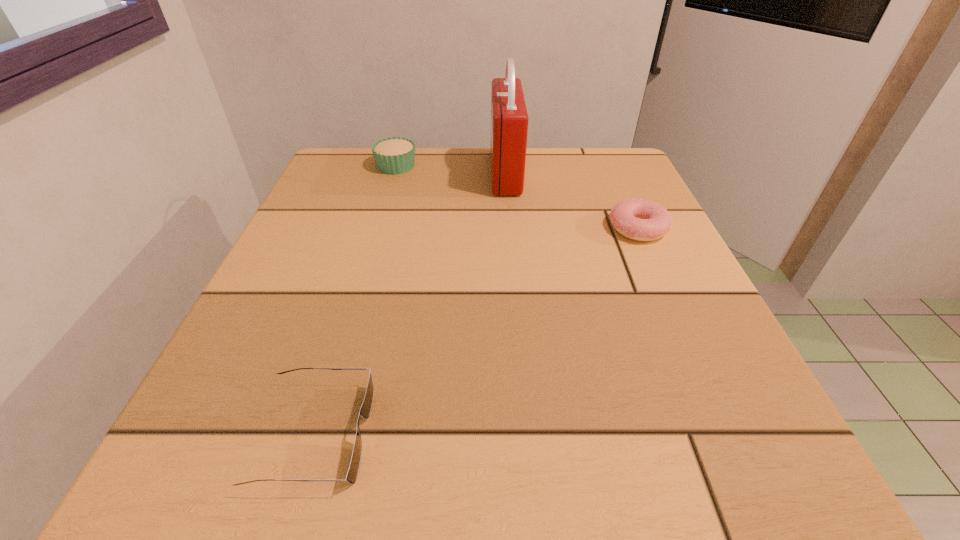
Where is `free region located 0.290m on the front of the rightmost object`? free region located 0.290m on the front of the rightmost object is located at coordinates (707, 379).

Locate an element on the screen. Image resolution: width=960 pixels, height=540 pixels. free location located on the front-facing side of the nearest object is located at coordinates (548, 434).

You are a GUI agent. You are given a task and a screenshot of the screen. Output one action in this format:
    pyautogui.click(x=<x>, y=<y>)
    Task: Click on the first-aid kit at the far edge
    The width and height of the screenshot is (960, 540).
    Given the screenshot: What is the action you would take?
    pyautogui.click(x=509, y=119)

Where is `cupcake that is at the far edge`? The height and width of the screenshot is (540, 960). cupcake that is at the far edge is located at coordinates (395, 155).

You are a GUI agent. You are given a task and a screenshot of the screen. Output one action in this format:
    pyautogui.click(x=<x>, y=<y>)
    Task: Click on the object positioned at the near edge
    This screenshot has height=540, width=960.
    Given the screenshot: What is the action you would take?
    pyautogui.click(x=365, y=410)

The image size is (960, 540). I want to click on cupcake located at the left edge, so click(x=395, y=155).

Locate an element on the screen. Image resolution: width=960 pixels, height=540 pixels. sunglasses at the left edge is located at coordinates (365, 410).

The width and height of the screenshot is (960, 540). I want to click on object that is at the right edge, so click(639, 219).

Where is `object that is at the far left corner`? This screenshot has height=540, width=960. object that is at the far left corner is located at coordinates (395, 155).

Locate an element on the screen. The width and height of the screenshot is (960, 540). object that is at the near left corner is located at coordinates (365, 410).